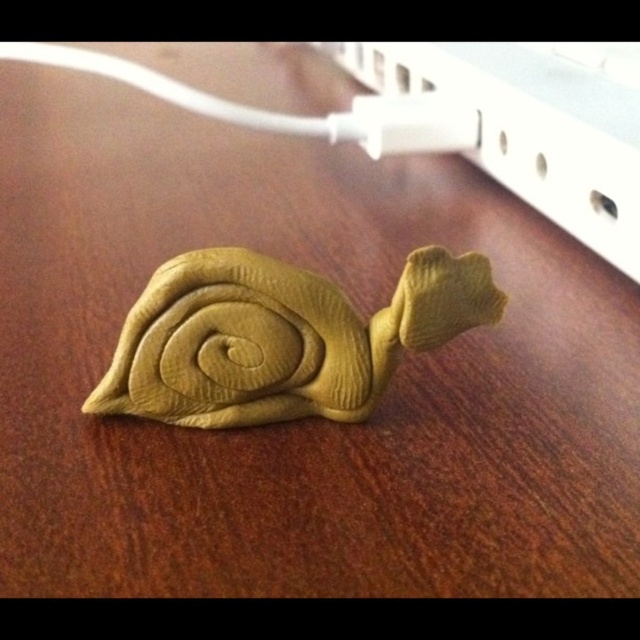
Question: Is matte yellow clay snail at center below white plastic plug at upper center?

Choices:
 (A) yes
 (B) no

Answer: (A)

Question: Can you confirm if matte yellow clay snail at center is positioned below white plastic plug at upper center?

Choices:
 (A) yes
 (B) no

Answer: (A)

Question: Is matte yellow clay snail at center below white plastic plug at upper center?

Choices:
 (A) no
 (B) yes

Answer: (B)

Question: Which object appears closest to the camera in this image?

Choices:
 (A) white plastic plug at upper center
 (B) matte yellow clay snail at center

Answer: (B)